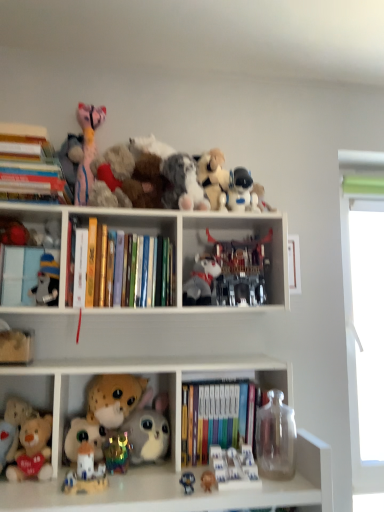
Question: From a real-world perspective, is fluffy beige teddy bear at lower left, acting as the first shelf starting from the bottom, physically located above or below transparent glass vase at lower right, which is counted as the 14th toy, starting from the left?

Choices:
 (A) below
 (B) above

Answer: (A)

Question: From the image's perspective, is fluffy beige teddy bear at lower left, acting as the first shelf starting from the bottom, located above or below transparent glass vase at lower right, which is counted as the 14th toy, starting from the left?

Choices:
 (A) above
 (B) below

Answer: (A)

Question: Which of these objects is positioned closest to the fuzzy beige stuffed animal at lower left, which is the 14th toy in right-to-left order?

Choices:
 (A) fluffy beige teddy bear at lower left, the 2th shelf in the top-to-bottom sequence
 (B) white matte bookshelf at upper center, the 1th shelf positioned from the top
 (C) white matte penguin at left
 (D) white matte cards at lower center, the eleventh toy from the left
 (E) white plush toy at lower left, which is the 4th toy in left-to-right order

Answer: (C)

Question: Estimate the real-world distances between objects in this image. Which object is farther from the green fabric at right?

Choices:
 (A) white plastic toy house at lower left, which is counted as the tenth toy, starting from the right
 (B) metallic silver robot at center, positioned as the third toy in right-to-left order
 (C) white matte bookshelf at upper center, the 1th shelf positioned from the top
 (D) rainbow plastic toy at lower center, the seventh toy in the left-to-right sequence
 (E) white plastic robot at upper center, placed as the 13th toy when sorted from left to right

Answer: (A)